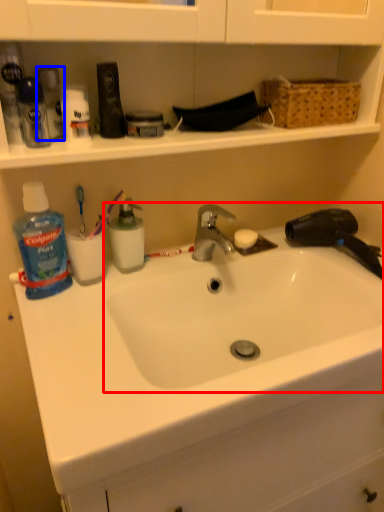
Question: Which object is closer to the camera taking this photo, sink (highlighted by a red box) or toiletry (highlighted by a blue box)?

Choices:
 (A) sink
 (B) toiletry

Answer: (A)